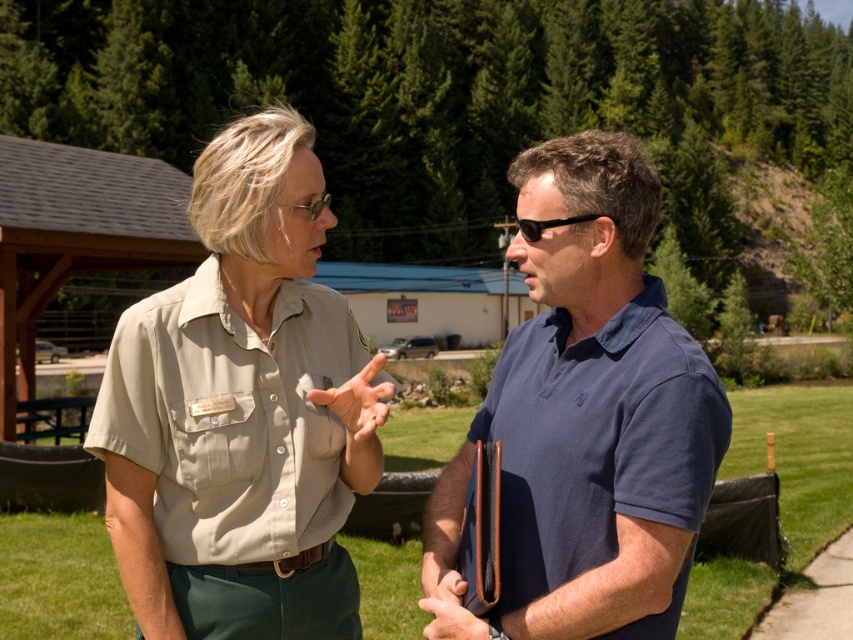
Question: Which of these objects is positioned farthest from the blue fabric shirt at center?

Choices:
 (A) matte khaki shirt at center
 (B) beige uniform shirt at center

Answer: (A)

Question: Among these objects, which one is nearest to the camera?

Choices:
 (A) matte khaki shirt at center
 (B) blue fabric shirt at center
 (C) beige uniform shirt at center

Answer: (C)

Question: From the image, what is the correct spatial relationship of matte khaki shirt at center in relation to blue fabric shirt at center?

Choices:
 (A) right
 (B) left

Answer: (B)

Question: Is beige uniform shirt at center in front of matte khaki shirt at center?

Choices:
 (A) yes
 (B) no

Answer: (A)

Question: Estimate the real-world distances between objects in this image. Which object is farther from the blue fabric shirt at center?

Choices:
 (A) beige uniform shirt at center
 (B) matte khaki shirt at center

Answer: (B)

Question: Is beige uniform shirt at center to the right of blue fabric shirt at center from the viewer's perspective?

Choices:
 (A) yes
 (B) no

Answer: (B)